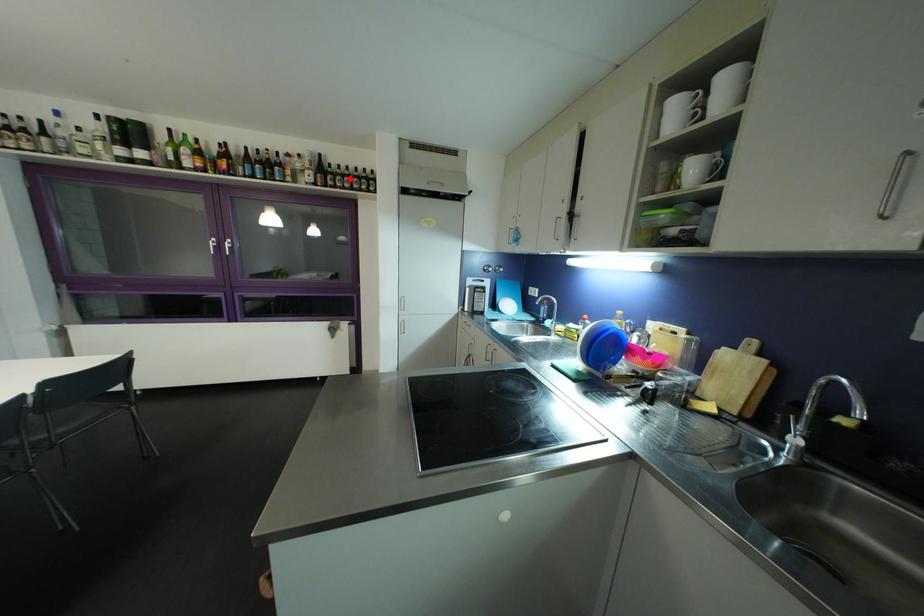
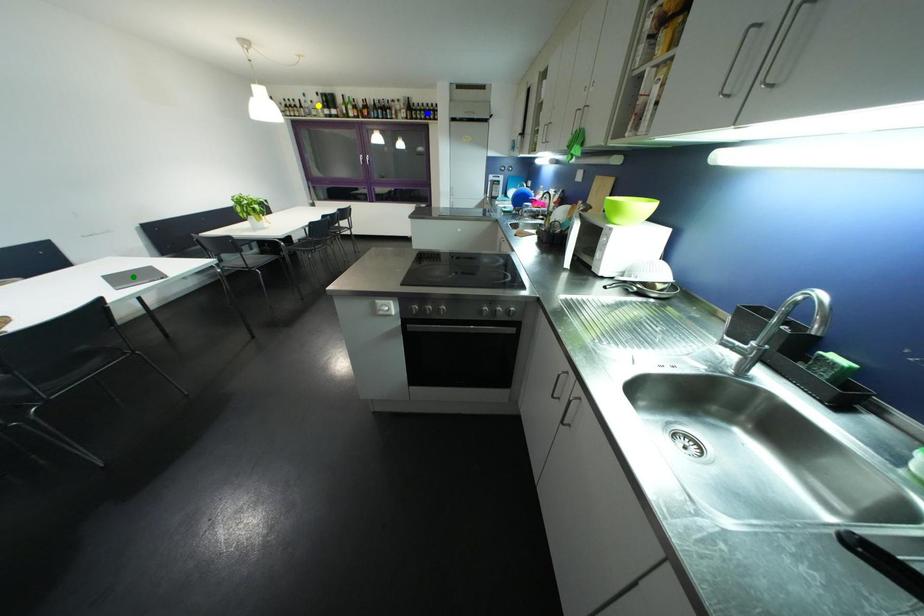
Question: I am providing you with two images of the same scene from different viewpoints. A red point is marked on the first image. You are given multiple points on the second image. Which point in image 2 is actually the same real-world point as the red point in image 1?

Choices:
 (A) yellow point
 (B) blue point
 (C) green point

Answer: (B)